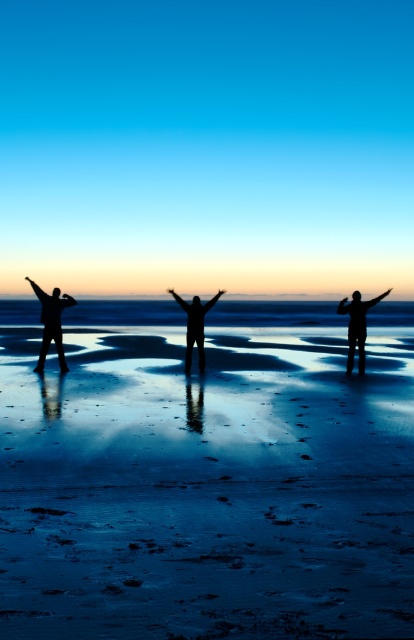
Between black matte person at center and black matte arm at center, which one is positioned higher?

black matte arm at center is above.

Is black matte person at center to the left of black matte arm at center from the viewer's perspective?

Correct, you'll find black matte person at center to the left of black matte arm at center.

Does point (190, 337) come farther from viewer compared to point (221, 291)?

No, (190, 337) is closer to viewer.

Where is `black matte person at center`? black matte person at center is located at coordinates (194, 324).

Which is behind, point (189, 321) or point (349, 307)?

The point (349, 307) is behind.

This screenshot has width=414, height=640. Describe the element at coordinates (194, 324) in the screenshot. I see `black matte person at center` at that location.

Where is `black matte person at center`? black matte person at center is located at coordinates (194, 324).

Can you confirm if matte black arm at left is thinner than black matte arm at left?

Indeed, matte black arm at left has a lesser width compared to black matte arm at left.

Does point (43, 292) come closer to viewer compared to point (67, 296)?

No, it is behind (67, 296).

The height and width of the screenshot is (640, 414). Identify the location of matte black arm at left. (38, 291).